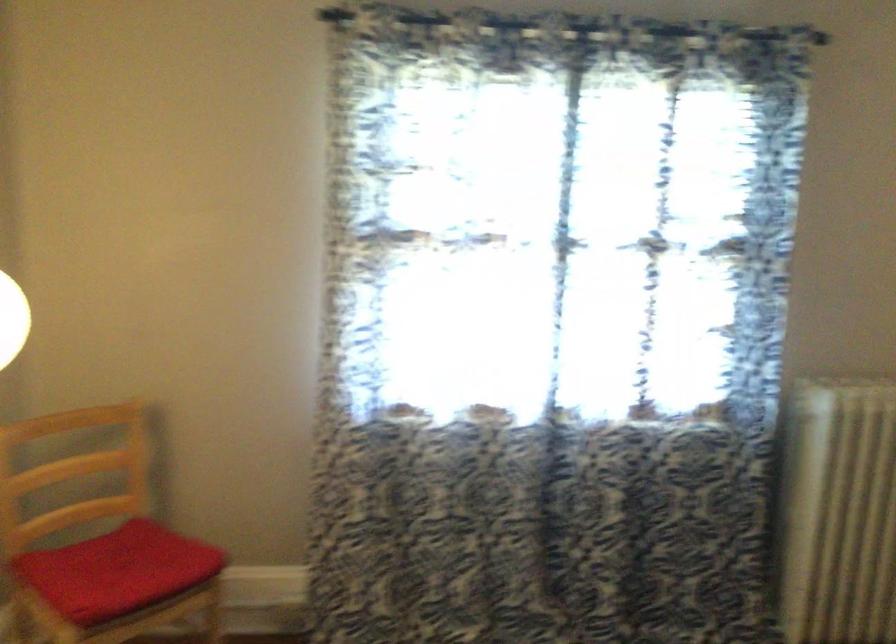
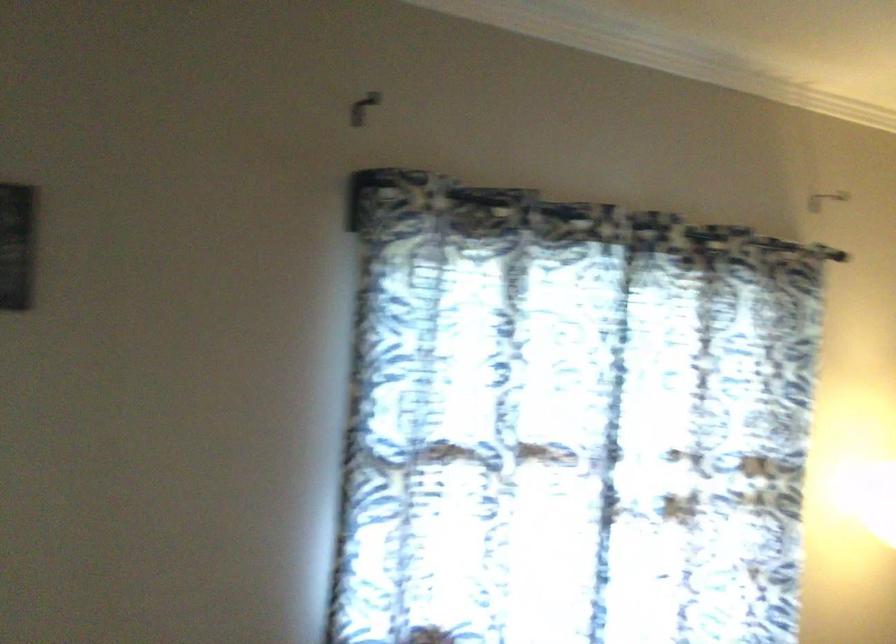
Question: The camera is either moving clockwise (left) or counter-clockwise (right) around the object. The first image is from the beginning of the video and the second image is from the end. Is the camera moving left or right when shooting the video?

Choices:
 (A) Left
 (B) Right

Answer: (B)